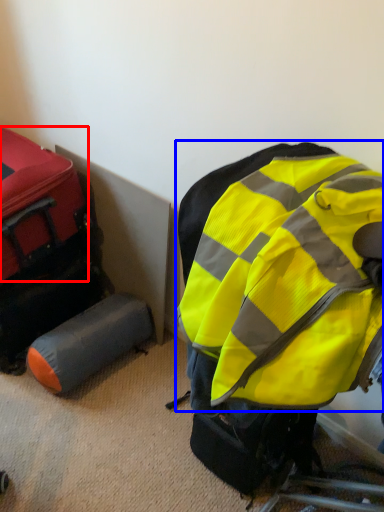
Question: Which of the following is the farthest to the observer, luggage (highlighted by a red box) or backpack (highlighted by a blue box)?

Choices:
 (A) luggage
 (B) backpack

Answer: (A)